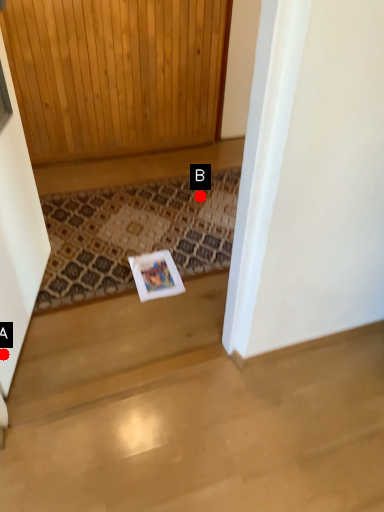
Question: Two points are circled on the image, labeled by A and B beside each circle. Among these points, which one is nearest to the camera?

Choices:
 (A) A is closer
 (B) B is closer

Answer: (A)